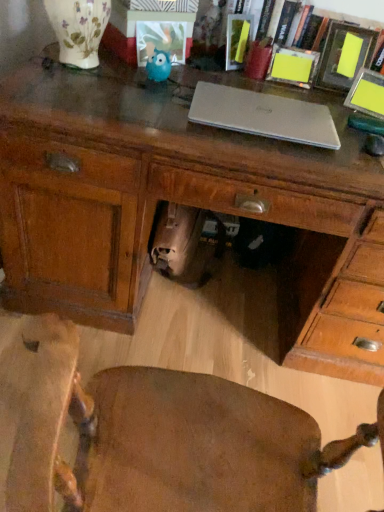
Question: From the image's perspective, is wooden desk at center located above or below yellow paper picture frame at upper right, which ranks as the 1th picture frame in right-to-left order?

Choices:
 (A) above
 (B) below

Answer: (B)

Question: From a real-world perspective, relative to yellow paper picture frame at upper right, which ranks as the 4th picture frame in left-to-right order, is wooden desk at center vertically above or below?

Choices:
 (A) below
 (B) above

Answer: (A)

Question: Estimate the real-world distances between objects in this image. Which object is farther from the matte yellow book at upper center, acting as the second book starting from the right?

Choices:
 (A) matte yellow paper at upper right, acting as the first book starting from the right
 (B) wooden chair at center
 (C) wooden desk at center
 (D) yellow paper picture frame at upper right, placed as the 3th picture frame when sorted from right to left
 (E) matte wooden picture frame at upper right, which is the second picture frame in right-to-left order

Answer: (B)

Question: Which object is the closest to the yellow paper picture frame at upper right, which ranks as the 4th picture frame in left-to-right order?

Choices:
 (A) wooden chair at center
 (B) wooden desk at center
 (C) matte yellow paper at upper right, acting as the 2th book starting from the left
 (D) matte wooden picture frame at upper right, which is counted as the third picture frame, starting from the left
 (E) matte plastic picture frame at center, the first picture frame positioned from the left

Answer: (D)